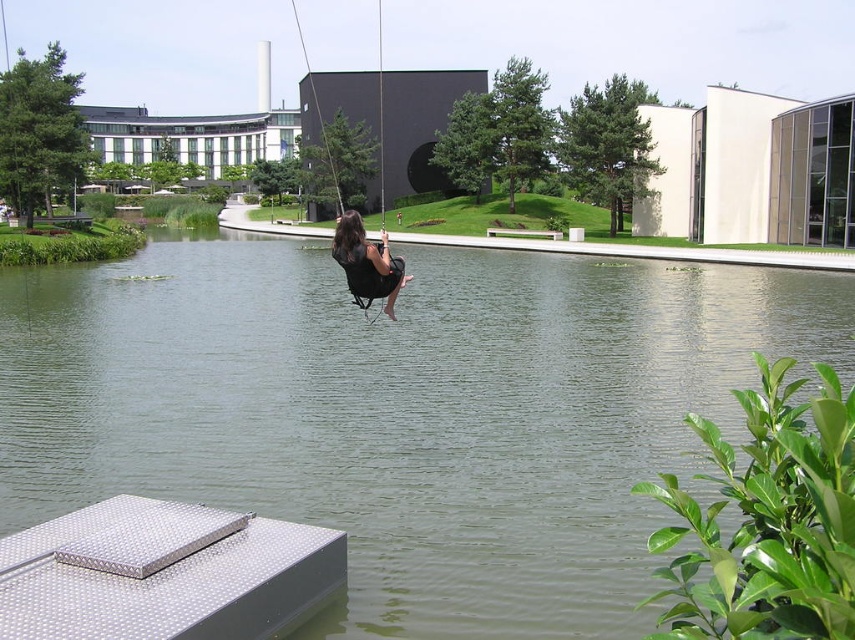
Question: Estimate the real-world distances between objects in this image. Which object is closer to the matte black swing at center?

Choices:
 (A) black fabric swing at center
 (B) green water at center

Answer: (B)

Question: Does green water at center come in front of black fabric swing at center?

Choices:
 (A) no
 (B) yes

Answer: (B)

Question: Which object is farther from the camera taking this photo?

Choices:
 (A) matte black swing at center
 (B) green water at center

Answer: (A)

Question: Which of the following is the closest to the observer?

Choices:
 (A) black fabric swing at center
 (B) matte black swing at center
 (C) green water at center

Answer: (C)

Question: Where is green water at center located in relation to black fabric swing at center in the image?

Choices:
 (A) right
 (B) left

Answer: (A)

Question: Is green water at center below matte black swing at center?

Choices:
 (A) no
 (B) yes

Answer: (A)